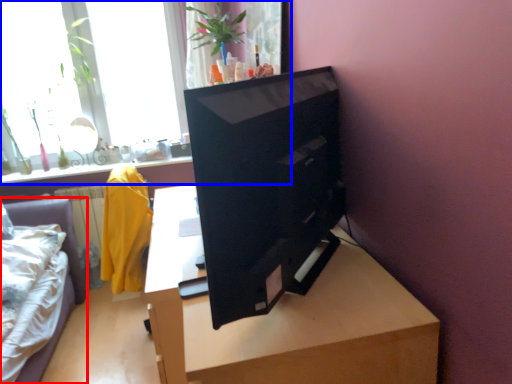
Question: Which object appears closest to the camera in this image, furniture (highlighted by a red box) or window (highlighted by a blue box)?

Choices:
 (A) furniture
 (B) window

Answer: (A)